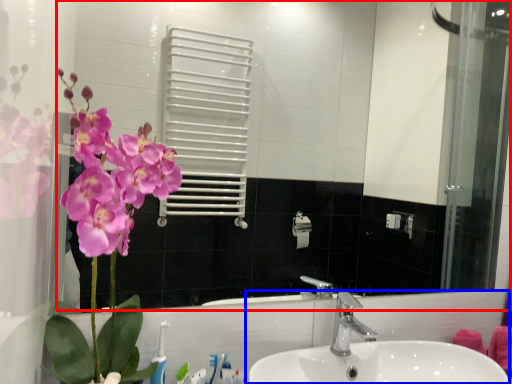
Question: Which of the following is the farthest to the observer, mirror (highlighted by a red box) or sink (highlighted by a blue box)?

Choices:
 (A) mirror
 (B) sink

Answer: (A)